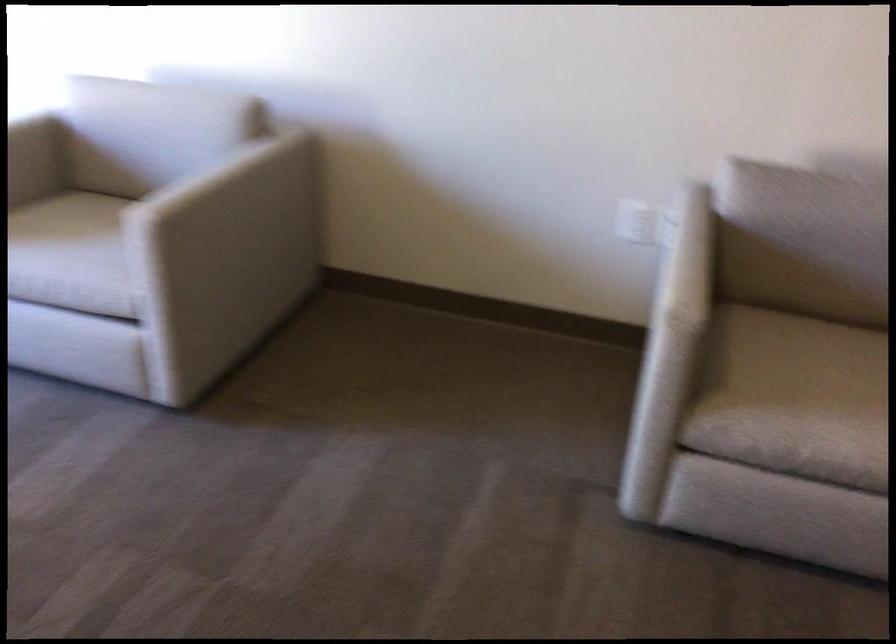
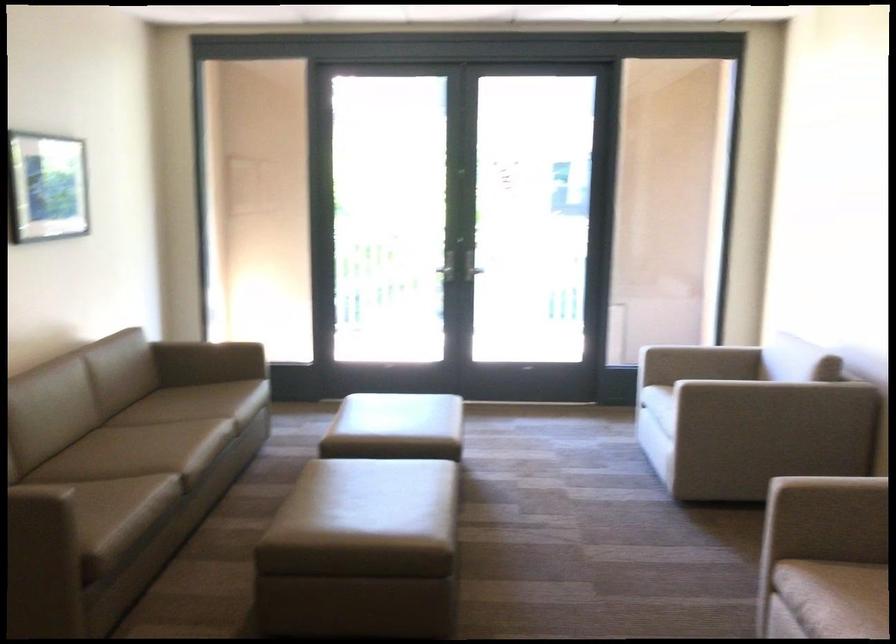
Locate, in the second image, the point that corresponds to the point at 271,169 in the first image.

(774, 392)